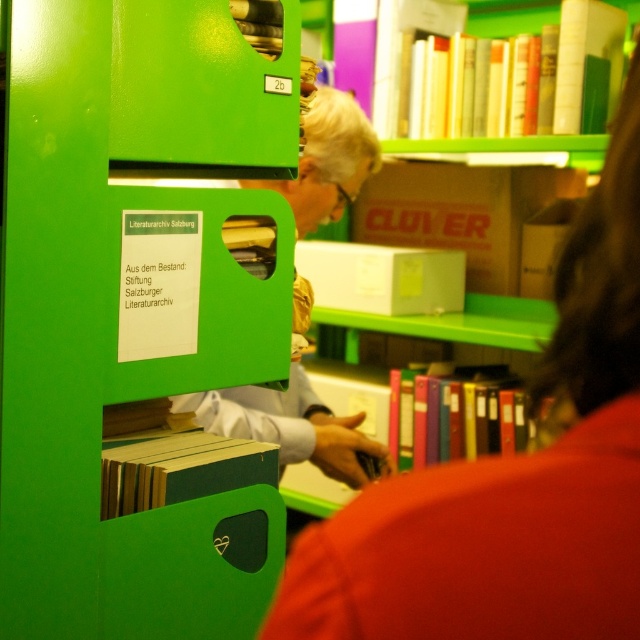
Between green matte book at center and multicolored plastic binders at center, which one appears on the left side from the viewer's perspective?

green matte book at center is more to the left.

Based on the photo, is green matte book at center to the right of multicolored plastic binders at center from the viewer's perspective?

No, green matte book at center is not to the right of multicolored plastic binders at center.

Is point (173, 424) positioned after point (461, 387)?

No.

The width and height of the screenshot is (640, 640). Identify the location of green matte book at center. pyautogui.click(x=172, y=460).

Is matte black laptop at upper center bigger than green matte book at center?

Yes, matte black laptop at upper center is bigger than green matte book at center.

Who is lower down, matte black laptop at upper center or green matte book at center?

green matte book at center is lower down.

Is point (612, 518) positioned in front of point (227, 456)?

Yes, point (612, 518) is in front of point (227, 456).

Find the location of `matte black laptop at upper center`. matte black laptop at upper center is located at coordinates coord(512,480).

Find the location of a particular element. This screenshot has height=640, width=640. green plastic bookcase at left is located at coordinates (140, 310).

What do you see at coordinates (140, 310) in the screenshot? I see `green plastic bookcase at left` at bounding box center [140, 310].

Which is in front, point (65, 372) or point (228, 461)?

Positioned in front is point (65, 372).

Where is `green plastic bookcase at left`? This screenshot has height=640, width=640. green plastic bookcase at left is located at coordinates (140, 310).